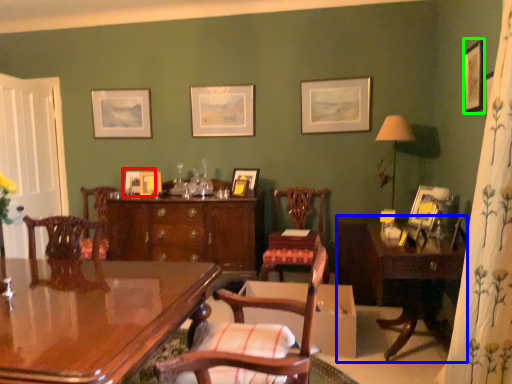
Question: Estimate the real-world distances between objects in this image. Which object is farther from picture frame (highlighted by a red box), table (highlighted by a blue box) or picture frame (highlighted by a green box)?

Choices:
 (A) table
 (B) picture frame

Answer: (B)